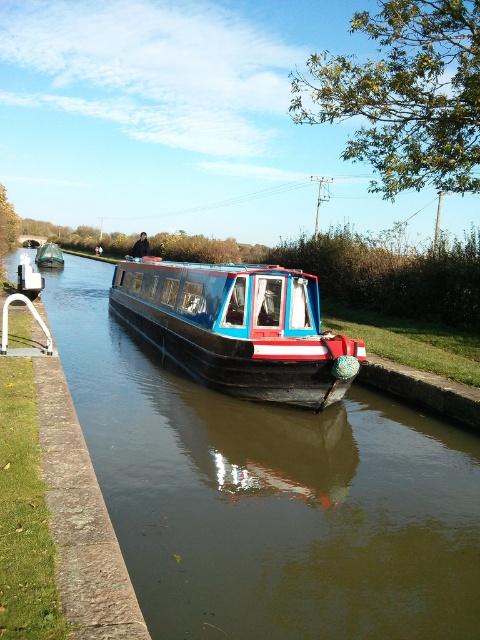
Is point (76, 406) closer to camera compared to point (51, 259)?

Yes, it is in front of point (51, 259).

Who is more distant from viewer, (212, 588) or (45, 260)?

The point (45, 260) is more distant.

Which is behind, point (429, 525) or point (41, 252)?

The point (41, 252) is behind.

Find the location of a particular element. brown wooden boat at center is located at coordinates (268, 496).

Which of these two, brown wooden boat at center or matte black boat at center, stands taller?

matte black boat at center is taller.

The width and height of the screenshot is (480, 640). What do you see at coordinates (268, 496) in the screenshot?
I see `brown wooden boat at center` at bounding box center [268, 496].

Find the location of a particular element. brown wooden boat at center is located at coordinates (268, 496).

Looking at this image, does matte black boat at center have a lesser height compared to matte blue and red boat at center?

Correct, matte black boat at center is not as tall as matte blue and red boat at center.

Image resolution: width=480 pixels, height=640 pixels. Describe the element at coordinates (239, 326) in the screenshot. I see `matte black boat at center` at that location.

Consider the image. Who is more distant from viewer, (257, 346) or (44, 266)?

Positioned behind is point (44, 266).

Where is `matte black boat at center`? This screenshot has width=480, height=640. matte black boat at center is located at coordinates (239, 326).